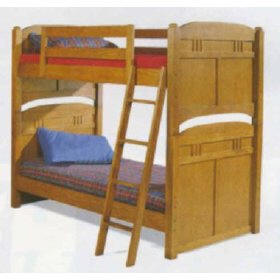
The image size is (280, 280). What are the coordinates of `upper bed frame` in the screenshot? It's located at (75, 68).